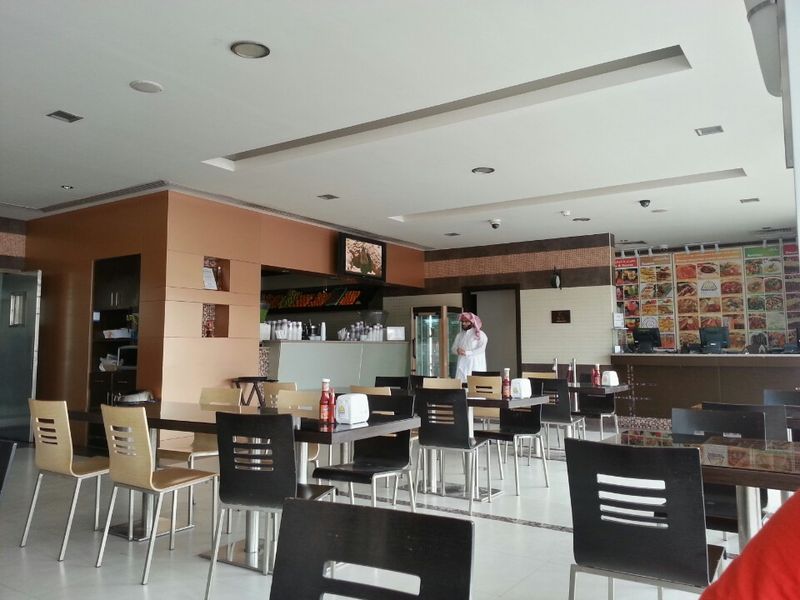
The image size is (800, 600). I want to click on white marble floor, so click(20, 484), click(46, 511), click(176, 567), click(534, 560), click(546, 500), click(553, 474).